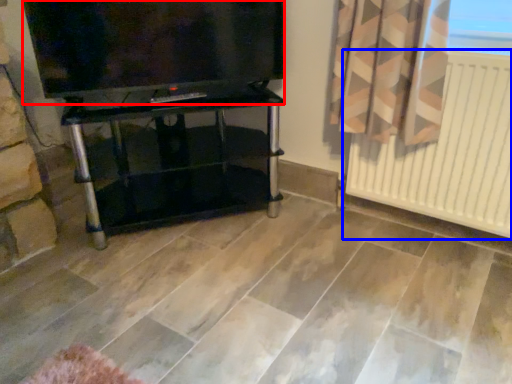
Question: Which point is further to the camera, television (highlighted by a red box) or radiator (highlighted by a blue box)?

Choices:
 (A) television
 (B) radiator

Answer: (A)